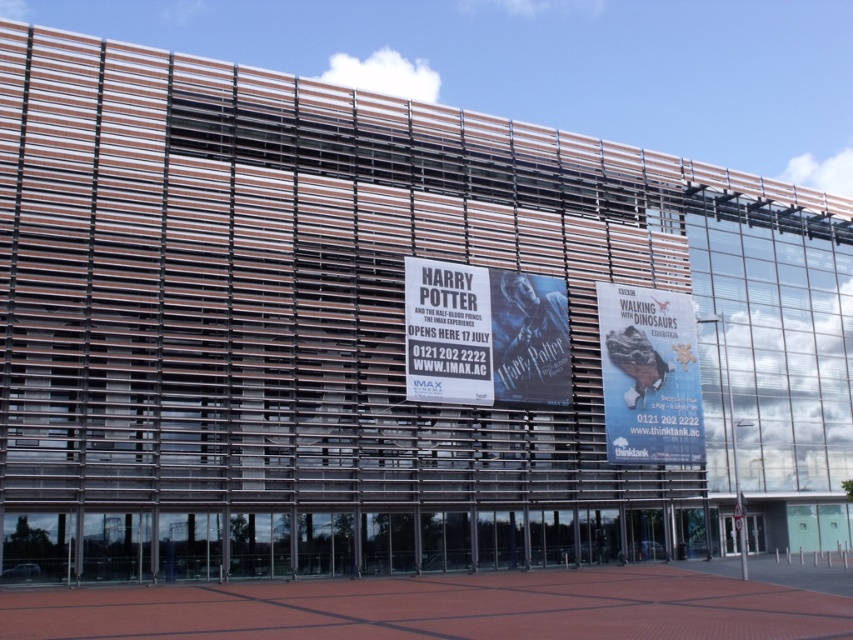
Does point (665, 445) come in front of point (482, 394)?

No.

Measure the distance between point (679, 312) and camera.

A distance of 57.66 meters exists between point (679, 312) and camera.

This screenshot has height=640, width=853. I want to click on white paper billboard at center, so click(648, 376).